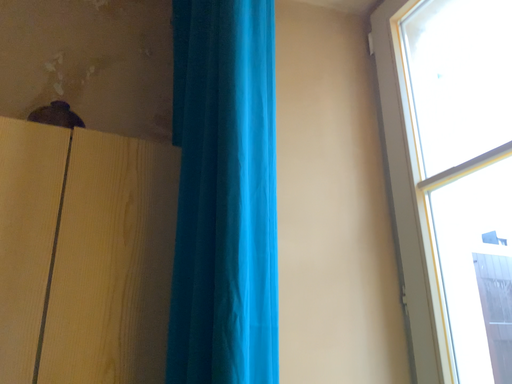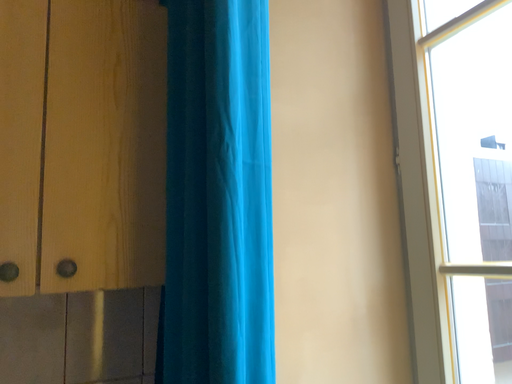
Question: How did the camera likely rotate when shooting the video?

Choices:
 (A) rotated upward
 (B) rotated downward

Answer: (B)